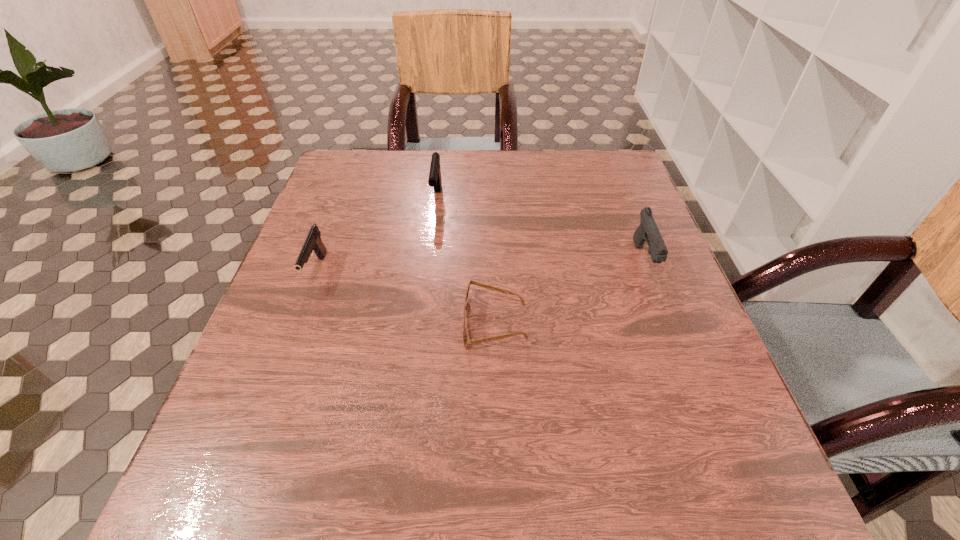
You are a GUI agent. You are given a task and a screenshot of the screen. Output one action in this format:
    pyautogui.click(x=<x>, y=<y>)
    Task: Click on the vacant space situated on the frames of the second object from right to left
    The width and height of the screenshot is (960, 540).
    Given the screenshot: What is the action you would take?
    pyautogui.click(x=310, y=324)

Find the location of a particular element. This screenshot has height=540, width=960. free location located 0.380m on the frames of the second object from right to left is located at coordinates (263, 324).

The width and height of the screenshot is (960, 540). I want to click on vacant space located on the frames of the second object from right to left, so click(268, 324).

You are a GUI agent. You are given a task and a screenshot of the screen. Output one action in this format:
    pyautogui.click(x=<x>, y=<y>)
    Task: Click on the object located at the far edge
    The image size is (960, 540).
    Given the screenshot: What is the action you would take?
    pyautogui.click(x=434, y=180)

Find the location of a particular element. object that is at the left edge is located at coordinates (313, 243).

Find the location of a particular element. object positioned at the right edge is located at coordinates (648, 231).

In the image, there is a desktop. Identify the location of free space at the far edge. (472, 194).

Locate an element on the screen. The image size is (960, 540). vacant space at the near edge of the desktop is located at coordinates (555, 521).

Where is `free location at the left edge of the desktop`? free location at the left edge of the desktop is located at coordinates (296, 298).

In the image, there is a desktop. Find the location of `vacant space at the right edge`. vacant space at the right edge is located at coordinates (628, 267).